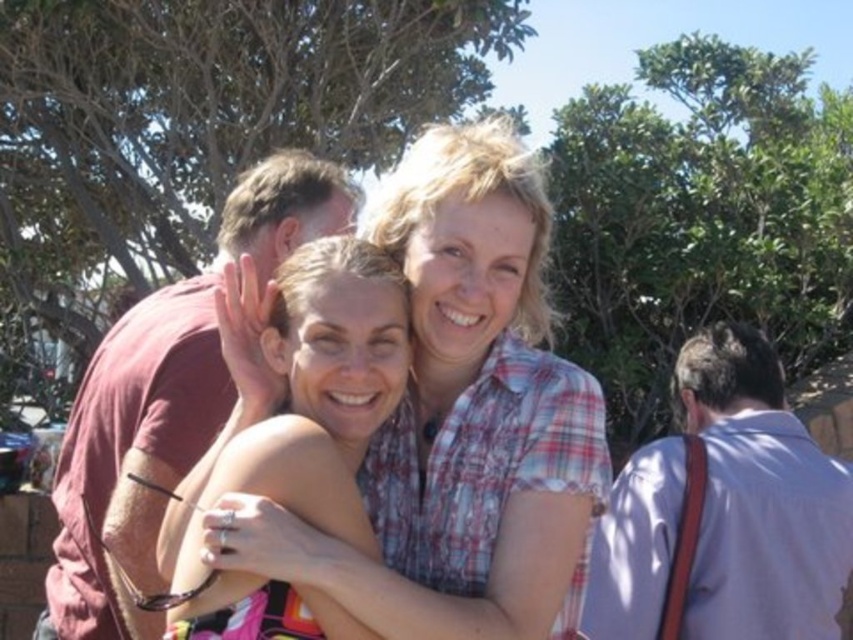
You are standing in a park and see two women in the distance. One is wearing a plaid shirt at center and the other a light gray shirt at right. Which woman is nearer to you?

The plaid shirt at center is closer to the viewer than the light gray shirt at right, so the woman wearing the plaid shirt at center is nearer to you.

In the scene shown: You are a photographer trying to capture a candid shot of both the light gray shirt at right and the maroon cotton shirt at left. Based on their positions, which shirt is closer to the camera?

The light gray shirt at right is closer to the camera because the maroon cotton shirt at left is behind it.

You are a photographer trying to capture the two women in the scene. You want to ensure that both the plaid shirt at center and the light gray shirt at right are clearly visible in your photo. Based on their positions, which shirt should you focus on first to ensure both are in frame?

The plaid shirt at center is positioned on the left side of light gray shirt at right, so focusing on the plaid shirt at center first will help ensure both shirts are in frame as they are aligned from left to right.